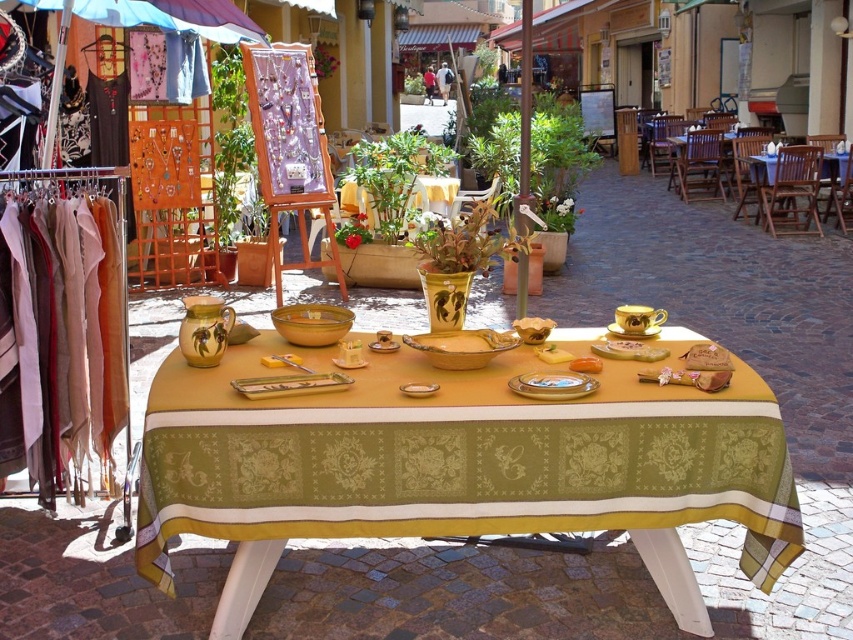
Question: Does yellow ceramic vase at center lie behind gold metallic platter at center?

Choices:
 (A) no
 (B) yes

Answer: (B)

Question: Is wooden chairs at right bigger than yellow ceramic vase at center?

Choices:
 (A) no
 (B) yes

Answer: (B)

Question: Which point appears closest to the camera in this image?

Choices:
 (A) (718, 140)
 (B) (575, 374)

Answer: (B)

Question: Does wooden chairs at right lie behind yellow matte plate at center?

Choices:
 (A) yes
 (B) no

Answer: (A)

Question: Which of the following is the farthest from the observer?

Choices:
 (A) (683, 180)
 (B) (7, 416)
 (C) (325, 492)

Answer: (A)

Question: Which point is farther to the camera?

Choices:
 (A) gold metallic platter at center
 (B) wooden chairs at right
 (C) yellow matte plate at center

Answer: (B)